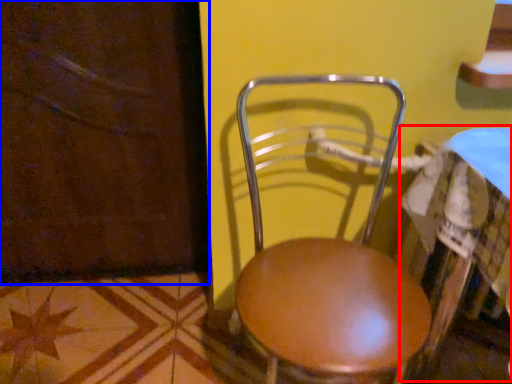
Question: Which object is further to the camera taking this photo, table (highlighted by a red box) or screen door (highlighted by a blue box)?

Choices:
 (A) table
 (B) screen door

Answer: (B)